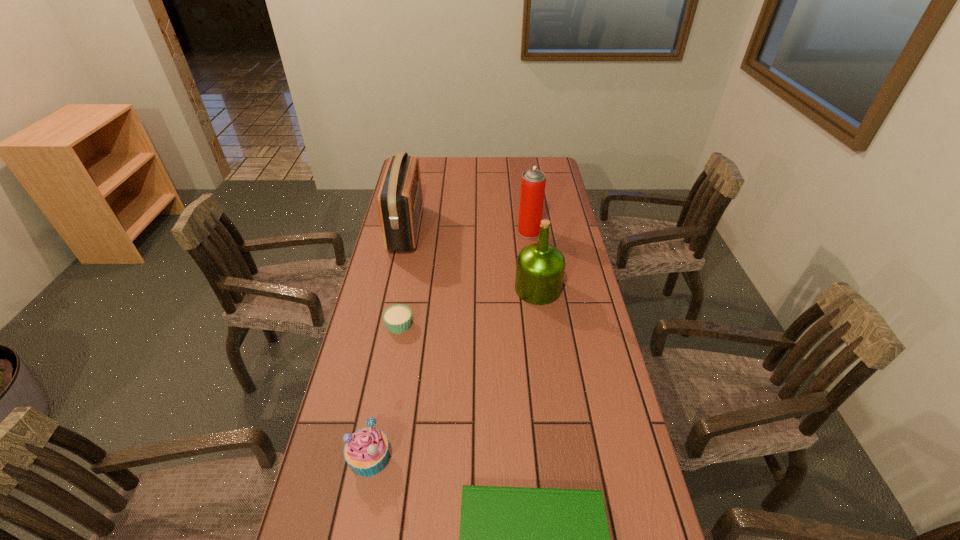
Locate an element on the screen. radio receiver is located at coordinates (400, 200).

Locate an element on the screen. The width and height of the screenshot is (960, 540). aerosol can is located at coordinates (533, 181).

You are a GUI agent. You are given a task and a screenshot of the screen. Output one action in this format:
    pyautogui.click(x=<x>, y=<y>)
    Task: Click on the olive oil
    The height and width of the screenshot is (540, 960).
    Given the screenshot: What is the action you would take?
    pyautogui.click(x=540, y=267)

Find the location of a particular element. muffin is located at coordinates [366, 450].

You are a GUI agent. You are given a task and a screenshot of the screen. Output one action in this format:
    pyautogui.click(x=<x>, y=<y>)
    Task: Click on the fourth tallest object
    The height and width of the screenshot is (540, 960).
    Given the screenshot: What is the action you would take?
    pyautogui.click(x=366, y=450)

At what (x,y) coordinates should I click in order to perform the action: click on the third nearest object. Please return your answer as a coordinate pair (x, y). This screenshot has width=960, height=540. Looking at the image, I should click on (397, 318).

Locate an element on the screen. cupcake is located at coordinates (397, 318).

Find the location of a particular element. vacant region located 0.230m on the front-facing side of the radio receiver is located at coordinates (479, 229).

Identify the location of free region located on the front of the aerosol can. (533, 256).

Find the location of `vacant space located 0.170m on the front of the fourth nearest object`. vacant space located 0.170m on the front of the fourth nearest object is located at coordinates (546, 347).